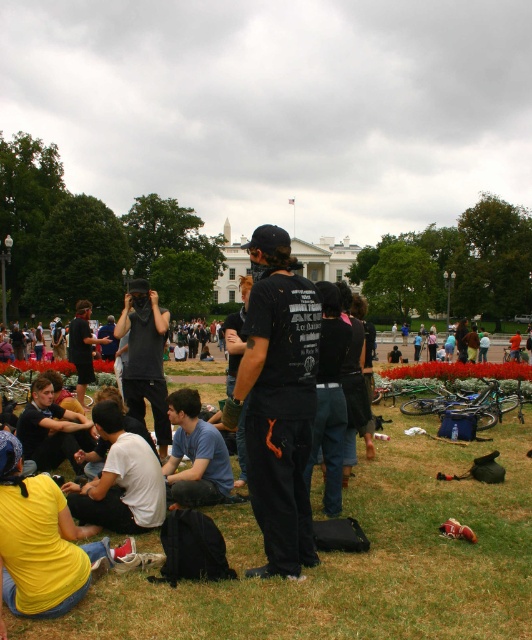
You are a photographer at the event and want to capture both the white matte shirt at lower left and the black cotton shirt at center in a single frame. Which shirt should you focus on first to ensure both are in the frame?

The white matte shirt at lower left is shorter than the black cotton shirt at center. To include both in the frame, focus on the black cotton shirt at center first since it is taller and adjust the camera angle to include the shorter white matte shirt at lower left.

You are a photographer standing at the edge of the crowd in front of the White House. You want to take a photo that includes both the blue cotton shirt at center and the dark gray hoodie at center. Given that your camera has a maximum zoom range of 20 meters, will you be able to capture both subjects in a single frame without moving closer?

The blue cotton shirt at center and dark gray hoodie at center are 21.11 meters apart from each other. Since the camera can only zoom up to 20 meters, the distance between them exceeds the maximum zoom range. Therefore, you cannot capture both subjects in a single frame without moving closer.

You are a photographer trying to capture a photo of the White House with the crowd in front of it. You notice the green grass at center and the blue cotton shirt at center. Which object would you focus on to ensure the background is blurred? Explain your reasoning.

The green grass at center is larger in size than the blue cotton shirt at center. To blur the background, focus on the larger object, so focus on the green grass at center.